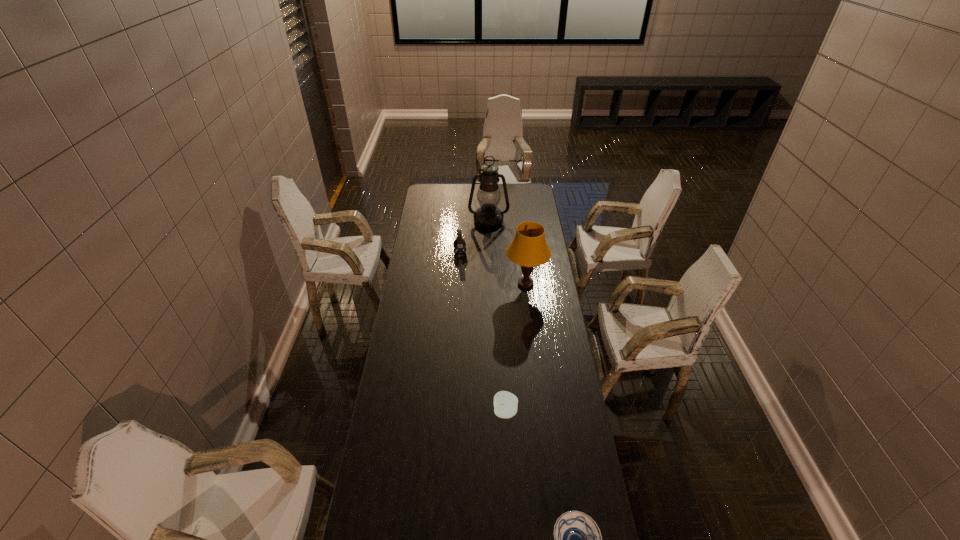
Find the location of a particular element. vacant space located 0.250m on the ear cups of the headset is located at coordinates (513, 253).

At what (x,y) coordinates should I click in order to perform the action: click on vacant area situated 0.100m on the left of the second nearest object. Please return your answer as a coordinate pair (x, y). The width and height of the screenshot is (960, 540). Looking at the image, I should click on (467, 412).

At what (x,y) coordinates should I click in order to perform the action: click on object at the right edge. Please return your answer as a coordinate pair (x, y). Looking at the image, I should click on (529, 249).

Identify the location of vacant space at the far edge of the desktop. The image size is (960, 540). (468, 203).

In the image, there is a desktop. At what (x,y) coordinates should I click in order to perform the action: click on vacant space at the left edge. Please return your answer as a coordinate pair (x, y). Looking at the image, I should click on (409, 367).

Identify the location of vacant point at the right edge. The width and height of the screenshot is (960, 540). (549, 496).

This screenshot has height=540, width=960. In order to click on vacant area that lies between the headset and the oil lamp in this screenshot , I will do `click(474, 237)`.

Where is `object that is the third closest to the tallest object`? The width and height of the screenshot is (960, 540). object that is the third closest to the tallest object is located at coordinates (505, 403).

Locate which object ranks third in proximity to the lampshade. Please provide its 2D coordinates. Your answer should be formatted as a tuple, i.e. [(x, y)], where the tuple contains the x and y coordinates of a point satisfying the conditions above.

[(505, 403)]

The height and width of the screenshot is (540, 960). Find the location of `vacant position in the image that satisfies the following two spatial constraints: 1. on the ear cups of the second farthest object; 2. on the left side of the fourth farthest object`. vacant position in the image that satisfies the following two spatial constraints: 1. on the ear cups of the second farthest object; 2. on the left side of the fourth farthest object is located at coordinates (451, 412).